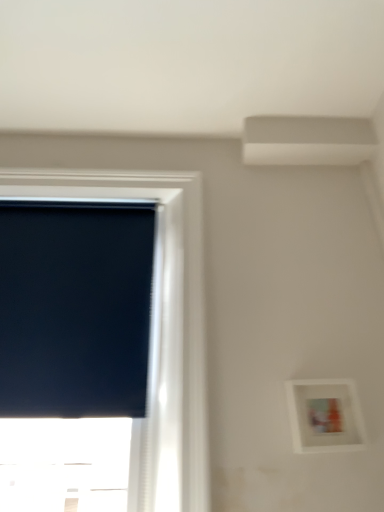
Question: Is black matte window screen at left taller or shorter than white matte picture frame at lower right?

Choices:
 (A) short
 (B) tall

Answer: (B)

Question: From a real-world perspective, is black matte window screen at left above or below white matte picture frame at lower right?

Choices:
 (A) below
 (B) above

Answer: (B)

Question: Based on their relative distances, which object is nearer to the white matte picture frame at lower right?

Choices:
 (A) black matte window at left
 (B) black matte window screen at left

Answer: (A)

Question: Considering the real-world distances, which object is farthest from the black matte window at left?

Choices:
 (A) black matte window screen at left
 (B) white matte picture frame at lower right

Answer: (B)